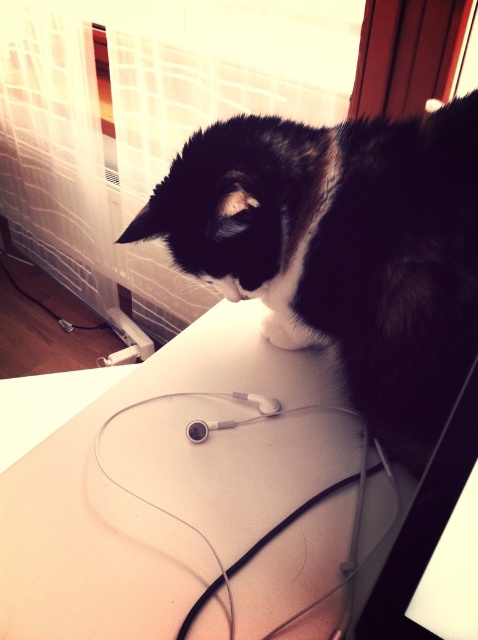
You are a delivery person who needs to place a small package on the white matte computer desk at center. However, there is a black glossy monitor at upper right in the way. Can you place the package directly on the desk without moving the monitor?

The white matte computer desk at center is further to the viewer than the black glossy monitor at upper right, so the monitor is closer to you. This means the monitor is blocking the desk, making it impossible to place the package directly on the desk without moving the monitor.

You are setting up a new monitor and want to place it on the white matte computer desk at center. However, you notice the black glossy monitor at upper right is already there. Considering their heights, will the new monitor fit on the desk without hanging over the edge?

The white matte computer desk at center is taller than the black glossy monitor at upper right, so the new monitor should fit on the desk without hanging over the edge since the desk has sufficient height to accommodate it.

You are a pet sitter who needs to place a small food bowl between the black fur cat at upper center and the black glossy monitor at upper right. Considering their heights, which object should the bowl be placed closer to?

The black fur cat at upper center is taller than the black glossy monitor at upper right, so the bowl should be placed closer to the black glossy monitor at upper right to ensure it is accessible to the cat.